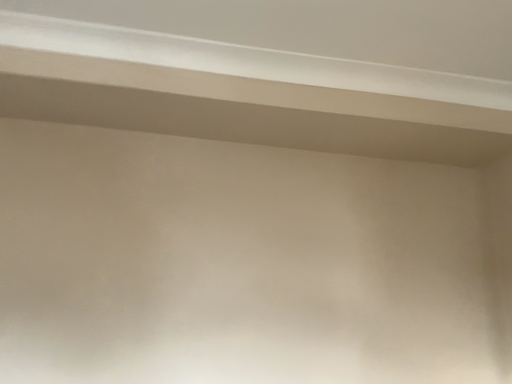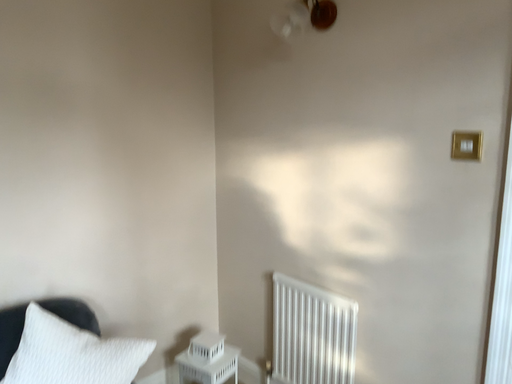
Question: Which way did the camera rotate in the video?

Choices:
 (A) rotated downward
 (B) rotated upward

Answer: (A)